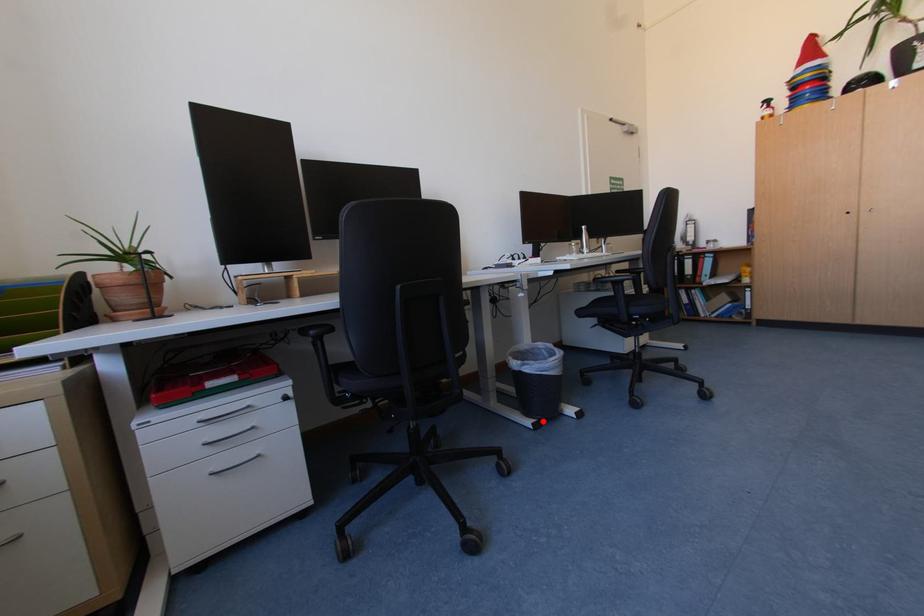
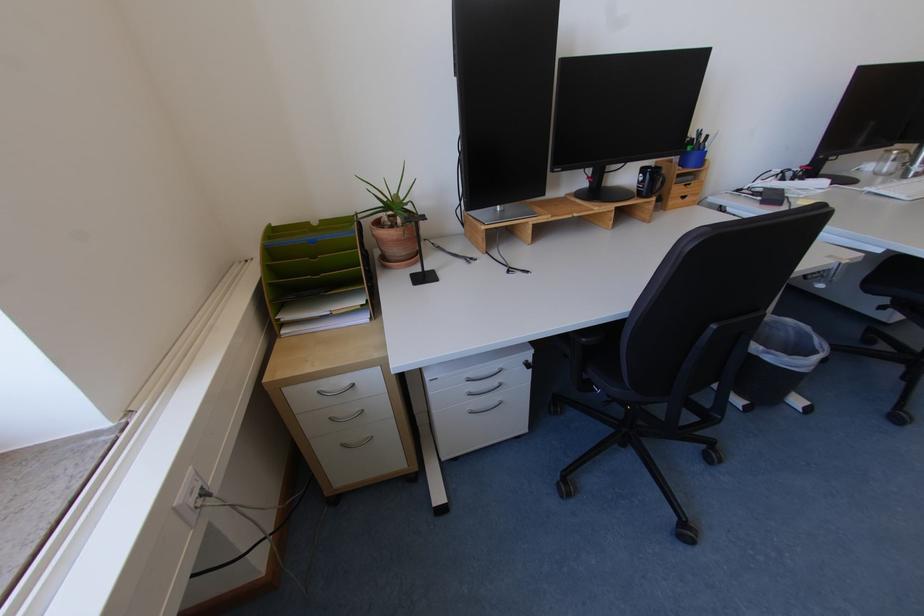
Question: A red point is marked in image1. In image2, is the corresponding 3D point closer to the camera or farther? Reply with the corresponding letter.

Choices:
 (A) The corresponding 3D point is closer.
 (B) The corresponding 3D point is farther.

Answer: (A)